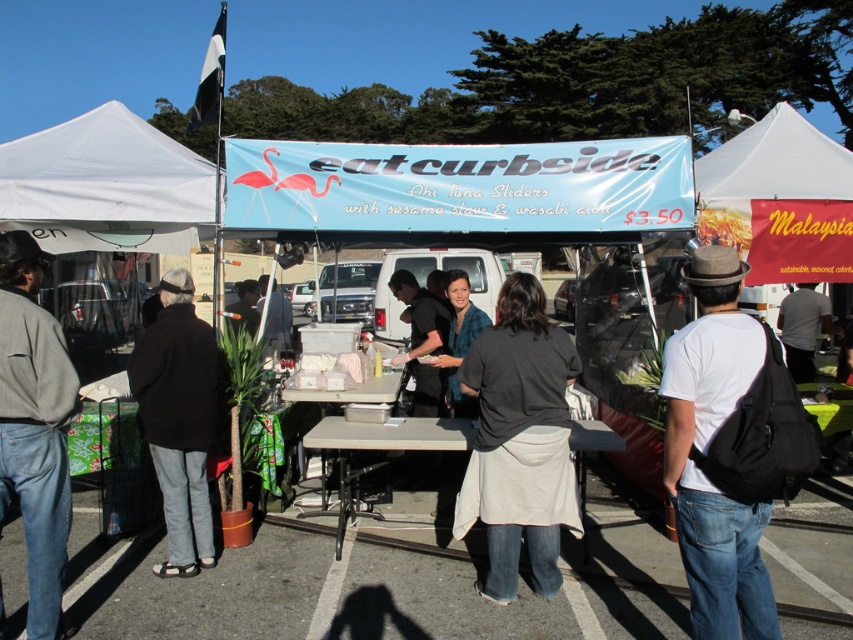
Question: From the image, what is the correct spatial relationship of white matte shirt at center in relation to white shirt at center?

Choices:
 (A) left
 (B) right

Answer: (A)

Question: Which of the following is the farthest from the observer?

Choices:
 (A) (407, 360)
 (B) (55, 390)

Answer: (A)

Question: Which of the following is the farthest from the observer?

Choices:
 (A) (136, 195)
 (B) (134, 396)

Answer: (A)

Question: Does dark gray fabric apron at center appear over white shirt at center?

Choices:
 (A) no
 (B) yes

Answer: (A)

Question: Which point is closer to the camera?

Choices:
 (A) (566, 374)
 (B) (67, 160)
 (C) (282, 314)

Answer: (A)

Question: Does white matte shirt at center have a smaller size compared to matte black shirt at center?

Choices:
 (A) no
 (B) yes

Answer: (B)